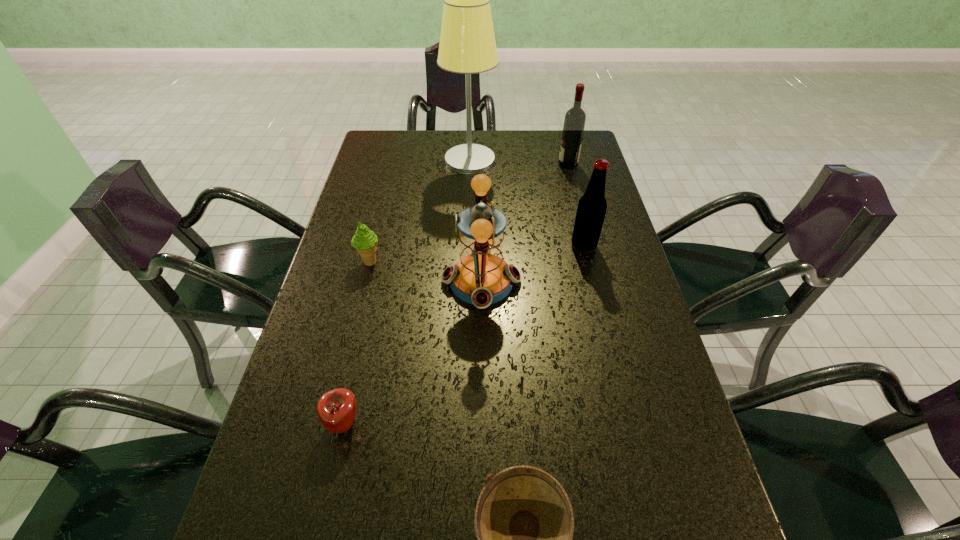
Locate an element on the screen. Image resolution: width=960 pixels, height=540 pixels. vacant space that is in between the table lamp and the alcohol is located at coordinates (518, 162).

This screenshot has height=540, width=960. Find the location of `object that is the third closest to the soup bowl`. object that is the third closest to the soup bowl is located at coordinates (365, 241).

Where is `object that is the fourth closest one to the apple`? This screenshot has height=540, width=960. object that is the fourth closest one to the apple is located at coordinates [592, 206].

The width and height of the screenshot is (960, 540). Find the location of `vacant space that satisfies the following two spatial constraints: 1. on the front side of the apple; 2. on the left side of the icecream`. vacant space that satisfies the following two spatial constraints: 1. on the front side of the apple; 2. on the left side of the icecream is located at coordinates (329, 424).

Where is `vacant space that satisfies the following two spatial constraints: 1. on the front and back of the alcohol; 2. on the front side of the beer bottle`? vacant space that satisfies the following two spatial constraints: 1. on the front and back of the alcohol; 2. on the front side of the beer bottle is located at coordinates (588, 246).

This screenshot has height=540, width=960. In order to click on free point that satisfies the following two spatial constraints: 1. on the front side of the table lamp; 2. on the left side of the beer bottle in this screenshot , I will do `click(468, 246)`.